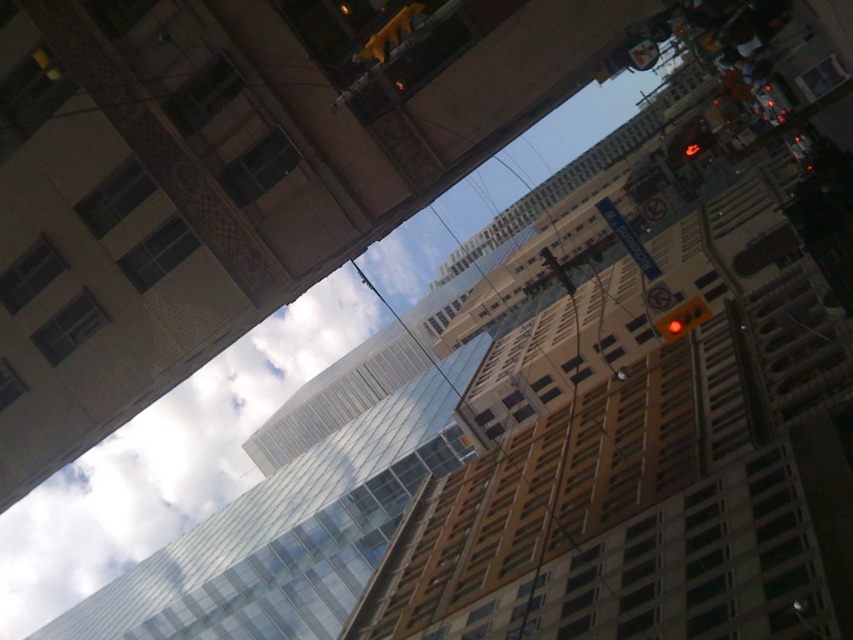
Question: Considering the real-world distances, which object is closest to the yellow plastic traffic light at upper right?

Choices:
 (A) yellow matte traffic light at upper center
 (B) white translucent cloud at upper center

Answer: (A)

Question: Which point appears closest to the camera in this image?

Choices:
 (A) (386, 45)
 (B) (703, 308)
 (C) (252, 385)

Answer: (A)

Question: Is white translucent cloud at upper center thinner than yellow plastic traffic light at upper right?

Choices:
 (A) no
 (B) yes

Answer: (A)

Question: Can you confirm if white translucent cloud at upper center is positioned to the right of yellow plastic traffic light at upper right?

Choices:
 (A) no
 (B) yes

Answer: (A)

Question: Which object is closer to the camera taking this photo?

Choices:
 (A) yellow plastic traffic light at upper right
 (B) white translucent cloud at upper center
 (C) yellow matte traffic light at upper center

Answer: (C)

Question: Is white translucent cloud at upper center positioned at the back of yellow plastic traffic light at upper right?

Choices:
 (A) no
 (B) yes

Answer: (B)